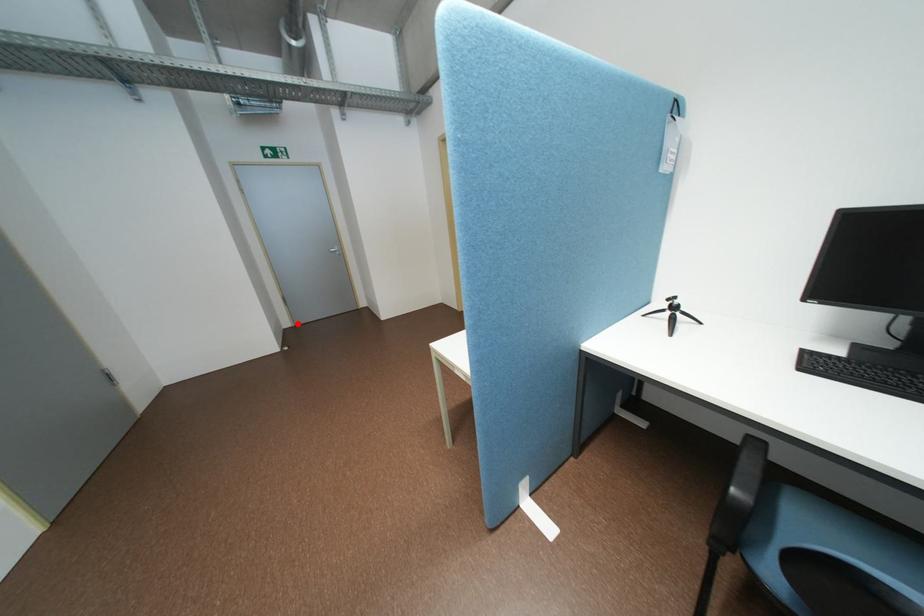
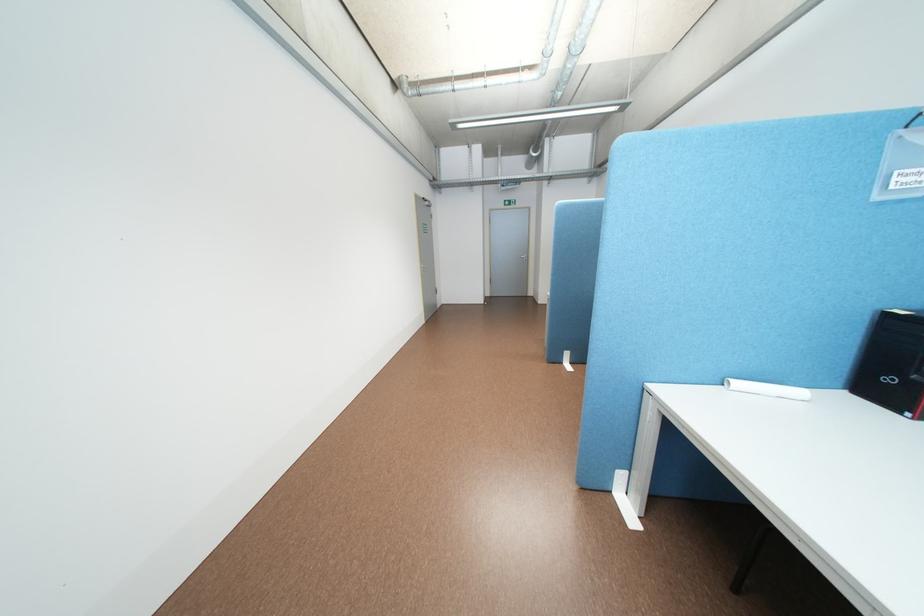
In the second image, find the point that corresponds to the highlighted location in the first image.

(499, 294)